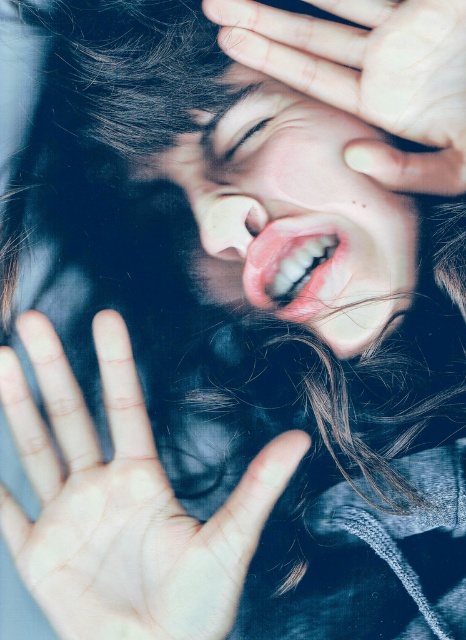
Does smooth skin face at center come behind matte skin at center?

That is False.

Between smooth skin face at center and matte skin at center, which one appears on the right side from the viewer's perspective?

smooth skin face at center is more to the right.

Between point (322, 202) and point (221, 152), which one is positioned in front?

Point (322, 202) is more forward.

Image resolution: width=466 pixels, height=640 pixels. I want to click on smooth skin face at center, so click(295, 216).

Does smooth skin hand at upper center appear under matte skin at center?

No.

Who is shorter, smooth skin hand at upper center or matte skin at center?

Standing shorter between the two is matte skin at center.

Between point (397, 168) and point (242, 141), which one is positioned in front?

Point (397, 168) is more forward.

Identify the location of smooth skin hand at upper center. This screenshot has width=466, height=640. (370, 76).

The image size is (466, 640). I want to click on smooth skin face at center, so click(x=295, y=216).

Is point (244, 81) positioned after point (293, 84)?

That is True.

At what (x,y) coordinates should I click in order to perform the action: click on smooth skin face at center. Please return your answer as a coordinate pair (x, y). Looking at the image, I should click on [x=295, y=216].